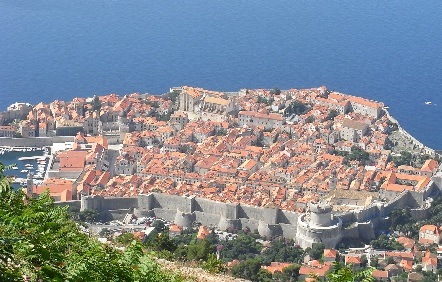
The width and height of the screenshot is (442, 282). In order to click on wall in this screenshot , I will do `click(331, 235)`.